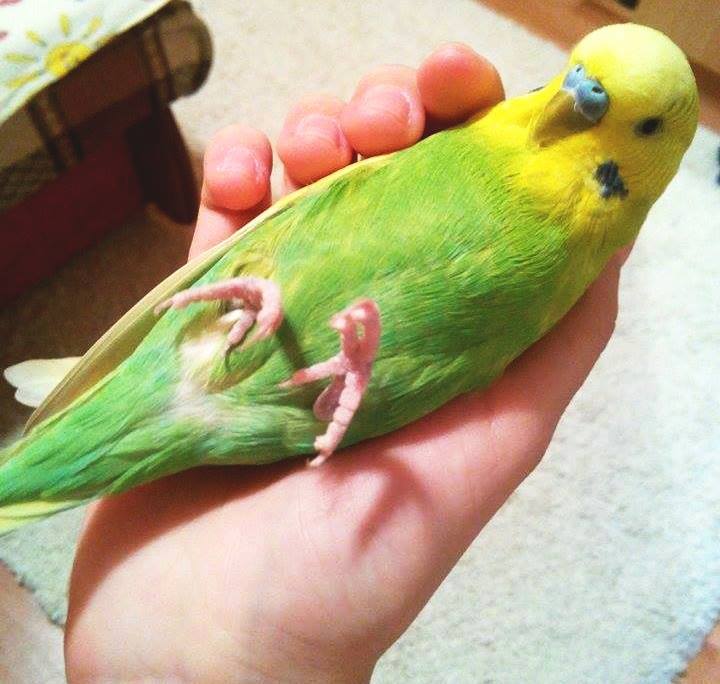
Locate an element on the screen. This screenshot has width=720, height=684. red ottoman is located at coordinates (72, 219).